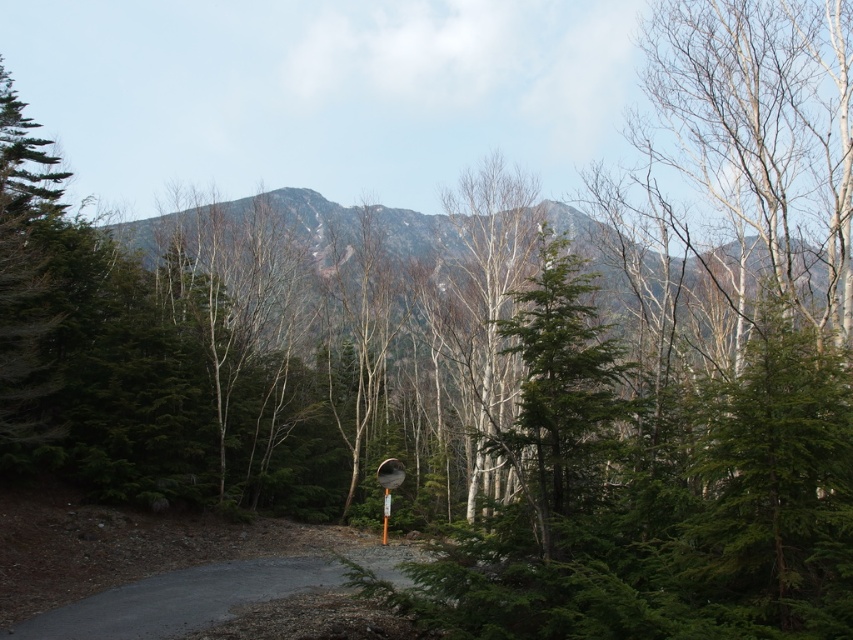
Is point (202, 246) positioned before point (503, 408)?

No, it is not.

Consider the image. Who is taller, gray rocky mountain at center or bare wood tree at center?

bare wood tree at center

Between point (403, 224) and point (479, 250), which one is positioned in front?

Point (479, 250) is in front.

Locate an element on the screen. The image size is (853, 640). gray rocky mountain at center is located at coordinates (309, 225).

Which is more to the left, gray asphalt road at center or bare wood tree at center?

From the viewer's perspective, gray asphalt road at center appears more on the left side.

The width and height of the screenshot is (853, 640). Find the location of `gray asphalt road at center`. gray asphalt road at center is located at coordinates (215, 604).

Can you confirm if green matte tree at center is positioned to the left of bare wood tree at center?

No, green matte tree at center is not to the left of bare wood tree at center.

Which is in front, point (521, 452) or point (468, 284)?

Positioned in front is point (521, 452).

The width and height of the screenshot is (853, 640). Find the location of `green matte tree at center`. green matte tree at center is located at coordinates (560, 387).